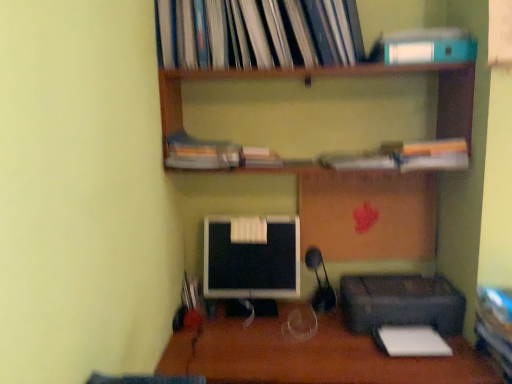
Identify the location of free area below hardcover book at upper center, which is the 2th book from top to bottom (from a real-world perspective). The image size is (512, 384). (222, 321).